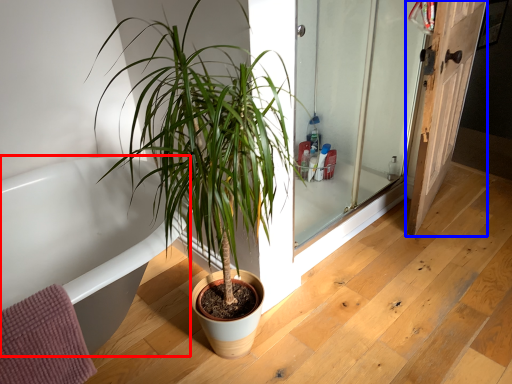
Question: Among these objects, which one is nearest to the camera, bathtub (highlighted by a red box) or door (highlighted by a blue box)?

Choices:
 (A) bathtub
 (B) door

Answer: (A)